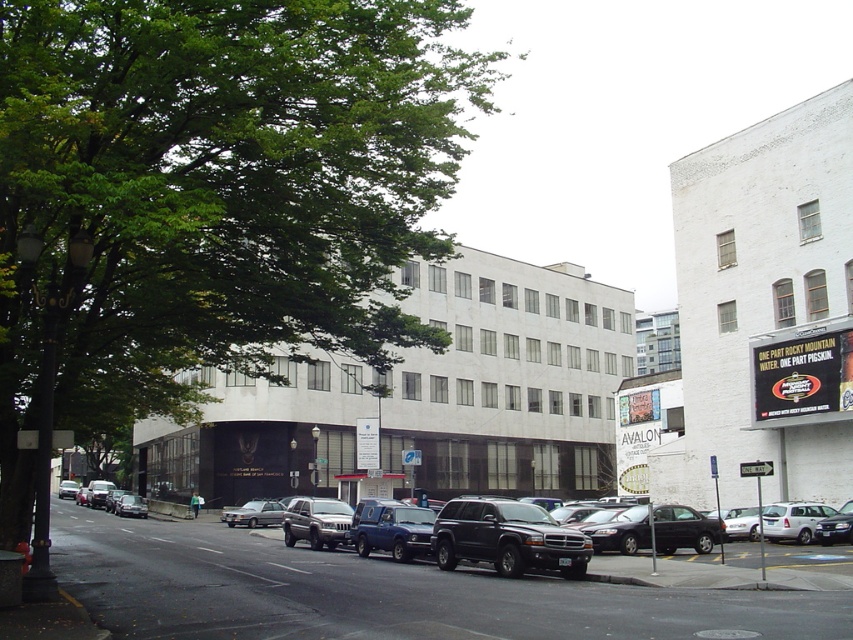
Question: Which object appears closest to the camera in this image?

Choices:
 (A) shiny black sedan at center
 (B) metallic silver suv at center
 (C) matte black suv at center

Answer: (C)

Question: Which object is closer to the camera taking this photo?

Choices:
 (A) shiny black sedan at center
 (B) green leafy tree at upper left
 (C) metallic silver suv at center
 (D) matte black suv at center

Answer: (B)

Question: Can you confirm if shiny black sedan at center is positioned above metallic silver suv at center?

Choices:
 (A) no
 (B) yes

Answer: (B)

Question: Is green leafy tree at upper left further to the viewer compared to metallic silver suv at center?

Choices:
 (A) no
 (B) yes

Answer: (A)

Question: Which object is closer to the camera taking this photo?

Choices:
 (A) shiny black sedan at center
 (B) silver metallic sedan at center
 (C) metallic silver suv at center

Answer: (A)

Question: Is matte black suv at center wider than silver metallic sedan at center?

Choices:
 (A) yes
 (B) no

Answer: (A)